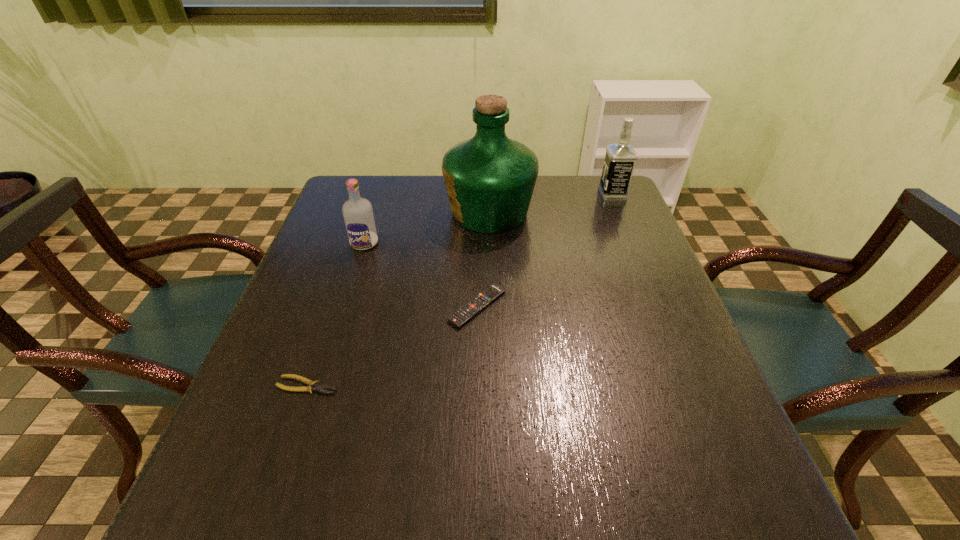
Identify the location of free space that is in between the nearest object and the tallest object. Image resolution: width=960 pixels, height=540 pixels. (398, 299).

Locate an element on the screen. Image resolution: width=960 pixels, height=540 pixels. vacant area between the third tallest object and the remote control is located at coordinates (420, 275).

Find the location of a particular element. free space between the liquor and the fourth tallest object is located at coordinates (483, 259).

Locate an element on the screen. This screenshot has width=960, height=540. free space between the third shortest object and the second shortest object is located at coordinates (420, 275).

The image size is (960, 540). Identify the location of empty space between the tallest object and the rightmost object. (551, 203).

Locate an element on the screen. Image resolution: width=960 pixels, height=540 pixels. empty space that is in between the fourth tallest object and the rightmost object is located at coordinates (545, 250).

This screenshot has width=960, height=540. I want to click on unoccupied area between the pliers and the remote control, so (393, 346).

The image size is (960, 540). Find the location of `free space between the shortest object and the remote control`. free space between the shortest object and the remote control is located at coordinates (393, 346).

Locate an element on the screen. This screenshot has width=960, height=540. object that is the third nearest to the right vodka is located at coordinates (358, 215).

Where is `object that is the fourth nearest to the second shortest object`? object that is the fourth nearest to the second shortest object is located at coordinates (620, 158).